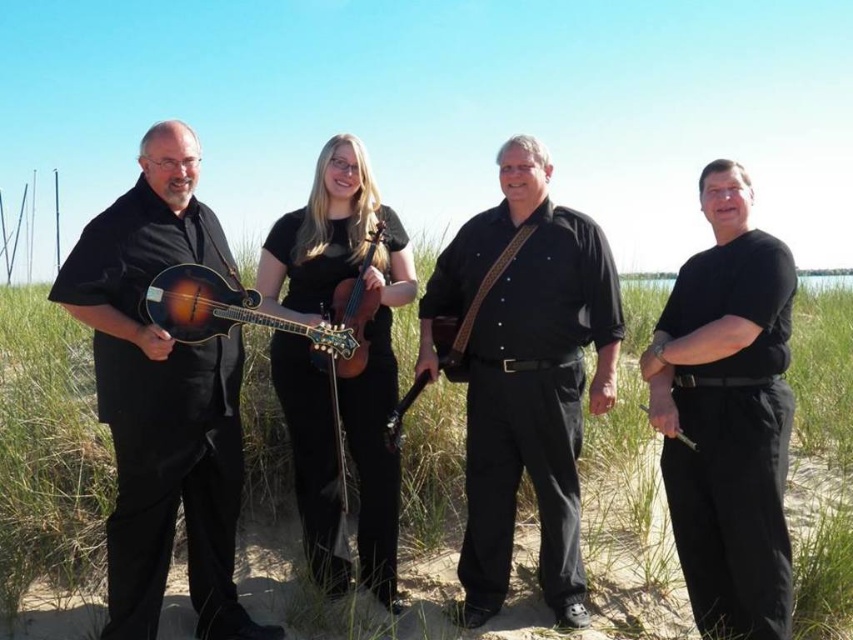
You are a photographer setting up for a group photo. You need to position the black leather guitar at center and the black matte violin at center so that they are side by side without overlapping. Given their sizes, which instrument should be placed on the left to accommodate their widths?

The black leather guitar at center should be placed on the left since it is wider than the black matte violin at center, allowing enough space between them to avoid overlapping.

You are a photographer trying to capture a photo of the satin wood mandolin at left and the wooden guitar at center. Based on their positions, which instrument should you focus on first to ensure both are in frame?

The satin wood mandolin at left should be focused on first since it is positioned above the wooden guitar at center, allowing the photographer to adjust the camera angle to include both instruments in the frame.

You are a photographer setting up for a group photo of the black leather guitar at center and the black matte violin at center. Which instrument should you position closer to the camera to ensure both are fully visible in the frame?

The black leather guitar at center is not as tall as the black matte violin at center, so positioning the black leather guitar at center closer to the camera will help ensure both are fully visible in the frame.